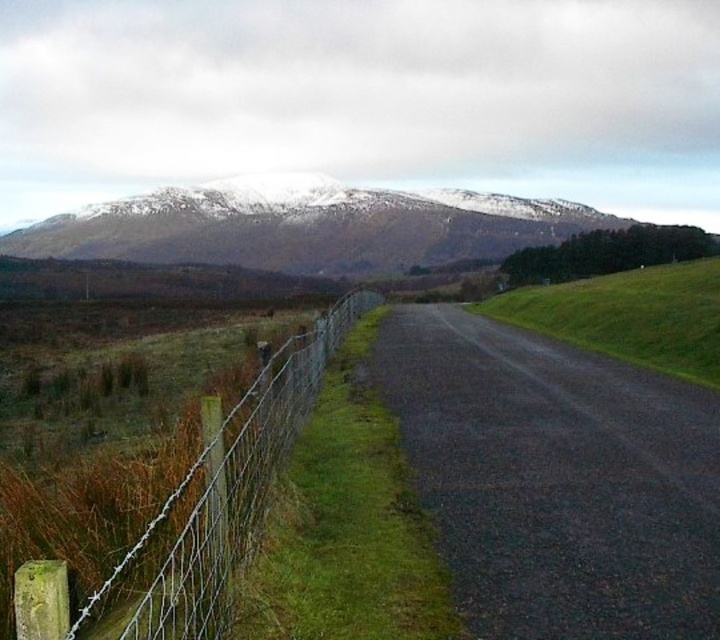
You are standing at the point marked as point (306, 227) in the image. Looking around, you see the road bordered by a wire fence on its left and snow on the hills. Which direction should you walk to reach the snow?

The point (306, 227) is located on the snow covered mountain at upper center. Since the snow is on the hills in the background, you should walk towards the upper center direction to reach the snow.